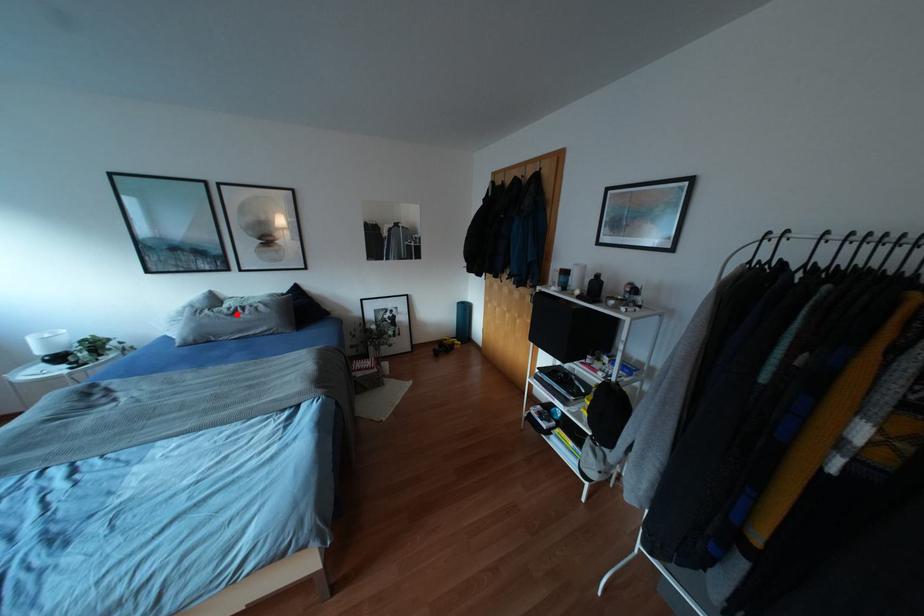
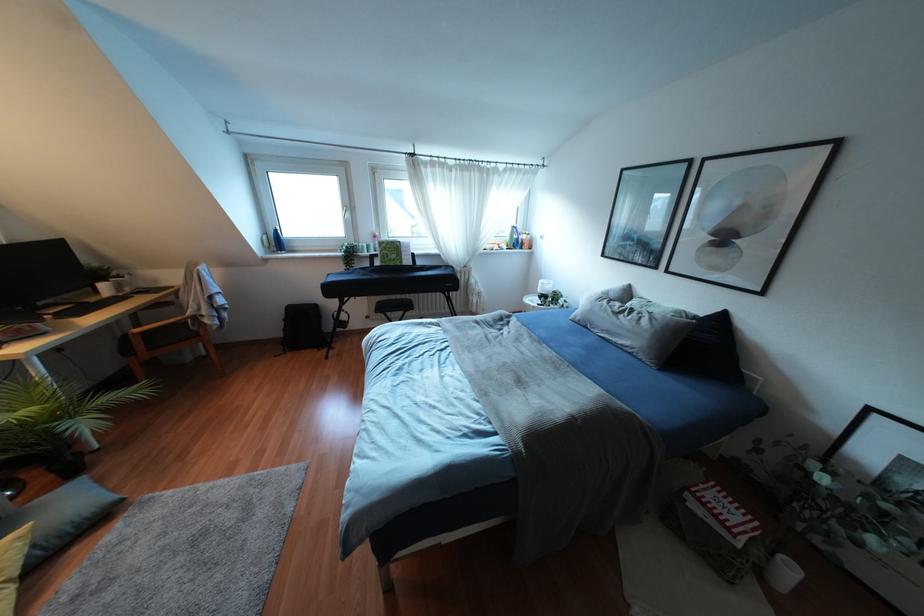
Question: I am providing you with two images of the same scene from different viewpoints. A red point is shown in image1. For the corresponding object point in image2, is it positioned nearer or farther from the camera?

Choices:
 (A) Nearer
 (B) Farther

Answer: (A)